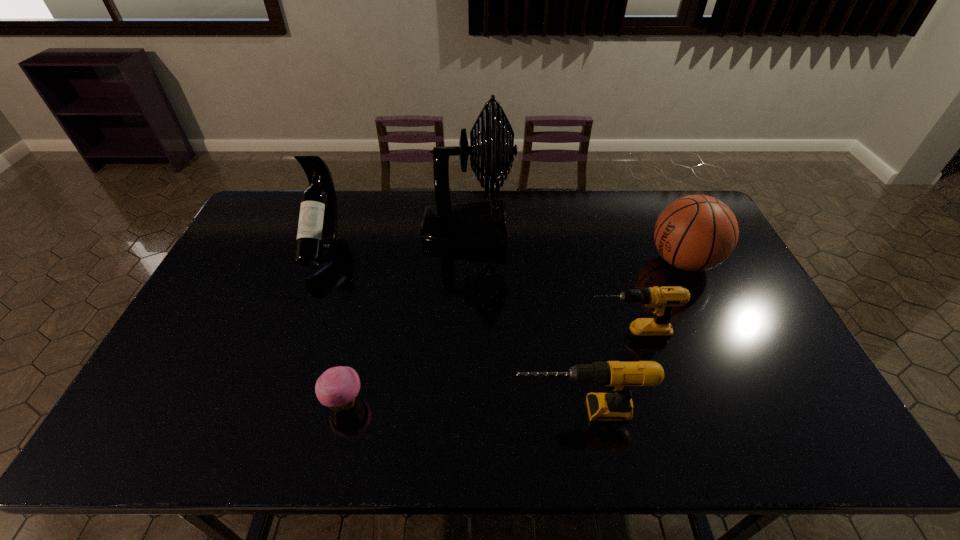
At what (x,y) coordinates should I click in order to perform the action: click on blank region between the basketball and the tallest object. Please return your answer as a coordinate pair (x, y). The width and height of the screenshot is (960, 540). Looking at the image, I should click on (575, 246).

You are a GUI agent. You are given a task and a screenshot of the screen. Output one action in this format:
    pyautogui.click(x=<x>, y=<y>)
    Task: Click on the vacant point located between the wine bottle and the fourth shortest object
    
    Given the screenshot: What is the action you would take?
    pyautogui.click(x=503, y=253)

Find the location of a particular element. The image size is (960, 540). free spot between the fifth object from right to left and the third tallest object is located at coordinates (514, 332).

Identify the location of empty location between the leftmost object and the shortest object. (334, 324).

Find the location of a particular element. The width and height of the screenshot is (960, 540). free spot between the fifth shortest object and the farther drill is located at coordinates (475, 291).

This screenshot has height=540, width=960. I want to click on empty space between the tallest object and the third tallest object, so click(575, 246).

Identify which object is the fourth closest to the nearer drill. Please provide its 2D coordinates. Your answer should be formatted as a tuple, i.e. [(x, y)], where the tuple contains the x and y coordinates of a point satisfying the conditions above.

[(481, 226)]

Find the location of a particular element. This screenshot has height=540, width=960. object that ranks as the closest to the third nearest object is located at coordinates (694, 233).

Find the location of a particular element. This screenshot has height=540, width=960. free region that satisfies the following two spatial constraints: 1. on the stand of the leftmost object; 2. on the right side of the second object from left to right is located at coordinates (264, 402).

What are the coordinates of `blank space that satisfies the following two spatial constraints: 1. on the stand of the fifth shortest object; 2. on the left side of the second object from left to right` in the screenshot? It's located at (264, 402).